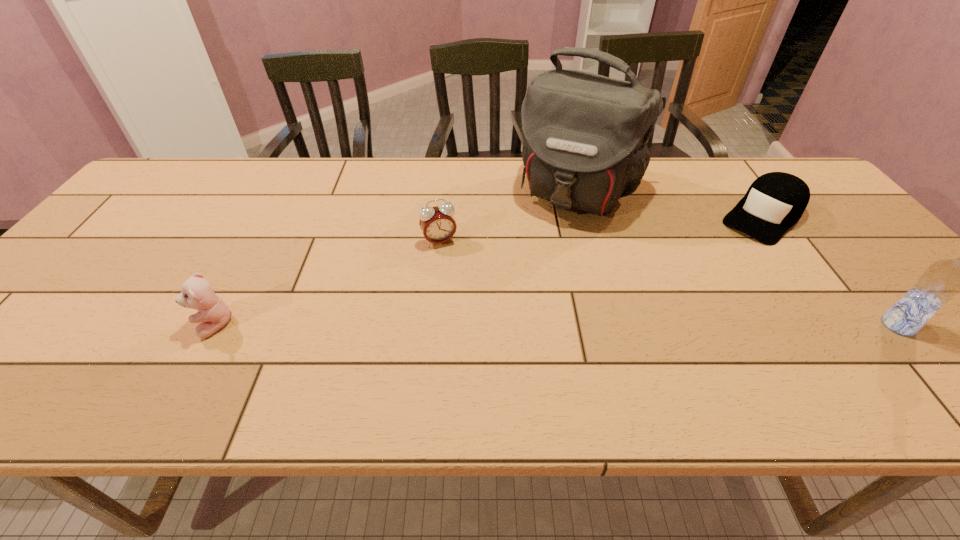
Where is `vacant space located on the front-facing side of the cap`? vacant space located on the front-facing side of the cap is located at coordinates (701, 275).

This screenshot has width=960, height=540. I want to click on vacant space located on the front-facing side of the cap, so click(x=713, y=264).

You are a GUI agent. You are given a task and a screenshot of the screen. Output one action in this format:
    pyautogui.click(x=<x>, y=<y>)
    Task: Click on the vacant space situated on the front-facing side of the cap
    
    Given the screenshot: What is the action you would take?
    pyautogui.click(x=674, y=300)

Identify the location of free space located on the clock face of the fourth object from right to left. (465, 296).

You are a GUI agent. You are given a task and a screenshot of the screen. Output one action in this format:
    pyautogui.click(x=<x>, y=<y>)
    Task: Click on the free space located on the clock face of the fourth object from right to left
    The width and height of the screenshot is (960, 540).
    Given the screenshot: What is the action you would take?
    pyautogui.click(x=475, y=322)

The width and height of the screenshot is (960, 540). Find the location of `vacant space located on the clock face of the fourth object from right to left`. vacant space located on the clock face of the fourth object from right to left is located at coordinates (465, 296).

The height and width of the screenshot is (540, 960). In order to click on free region located 0.190m on the open flap of the tallest object in this screenshot , I will do `click(531, 270)`.

This screenshot has height=540, width=960. Find the location of `free location located on the open flap of the tallest object`. free location located on the open flap of the tallest object is located at coordinates (534, 265).

At what (x,y) coordinates should I click in order to perform the action: click on vacant area located 0.190m on the open flap of the tallest object. Please return your answer as a coordinate pair (x, y). Image resolution: width=960 pixels, height=540 pixels. Looking at the image, I should click on (531, 270).

Where is `cap present at the far edge`? cap present at the far edge is located at coordinates (775, 201).